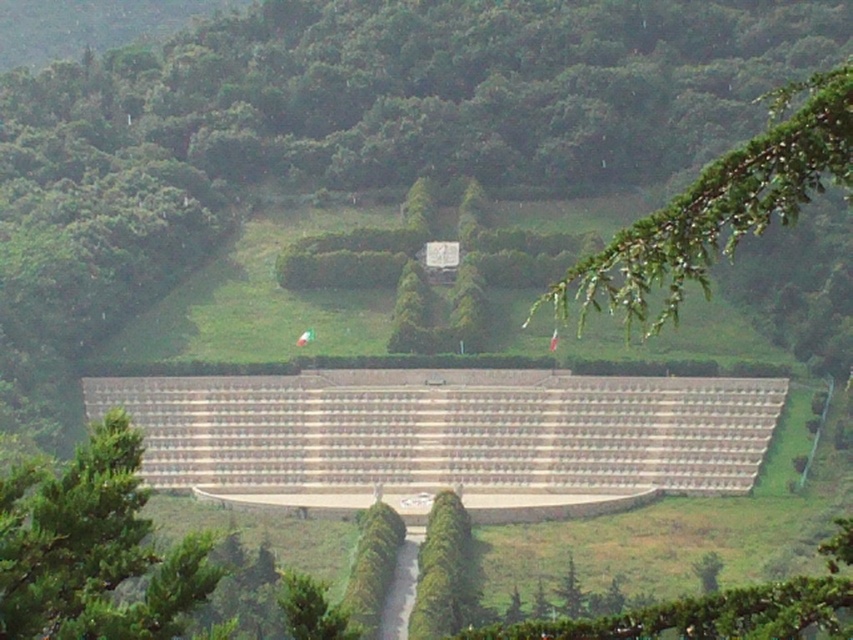
Is point (112, 490) closer to camera compared to point (448, 506)?

That is True.

Between green textured tree at center and green leafy tree at center, which one has more height?

With more height is green textured tree at center.

Which is behind, point (108, 528) or point (418, 611)?

Positioned behind is point (418, 611).

Locate an element on the screen. The image size is (853, 640). green textured tree at center is located at coordinates (91, 547).

Is green textured tree at center positioned behind green needle-like leaves at upper right?

Yes, it is behind green needle-like leaves at upper right.

Between green textured tree at center and green needle-like leaves at upper right, which one appears on the right side from the viewer's perspective?

Positioned to the right is green needle-like leaves at upper right.

This screenshot has width=853, height=640. What do you see at coordinates (91, 547) in the screenshot? I see `green textured tree at center` at bounding box center [91, 547].

Identify the location of green textured tree at center. (91, 547).

Between green needle-like leaves at upper right and green leafy tree at center, which one has more height?

With more height is green needle-like leaves at upper right.

Does point (654, 280) lie in front of point (436, 627)?

That is True.

Locate an element on the screen. green needle-like leaves at upper right is located at coordinates (718, 208).